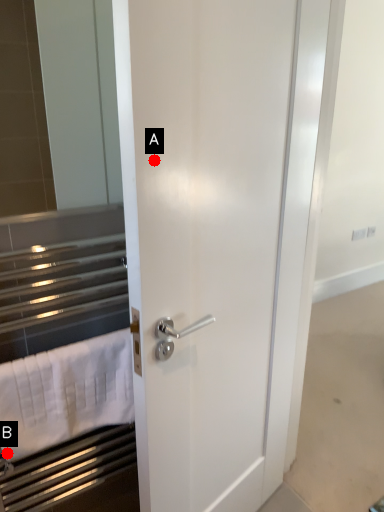
Question: Two points are circled on the image, labeled by A and B beside each circle. Which point is closer to the camera?

Choices:
 (A) A is closer
 (B) B is closer

Answer: (A)